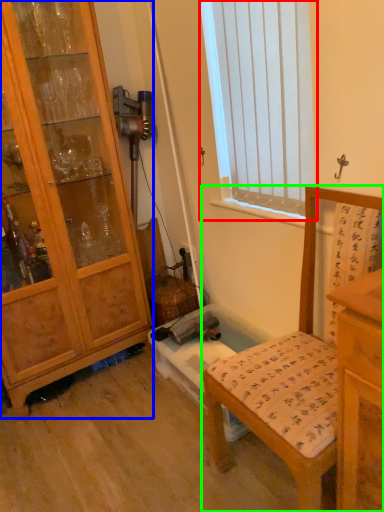
Question: Which is farther away from window (highlighted by a red box)? cabinetry (highlighted by a blue box) or chair (highlighted by a green box)?

Choices:
 (A) cabinetry
 (B) chair

Answer: (B)